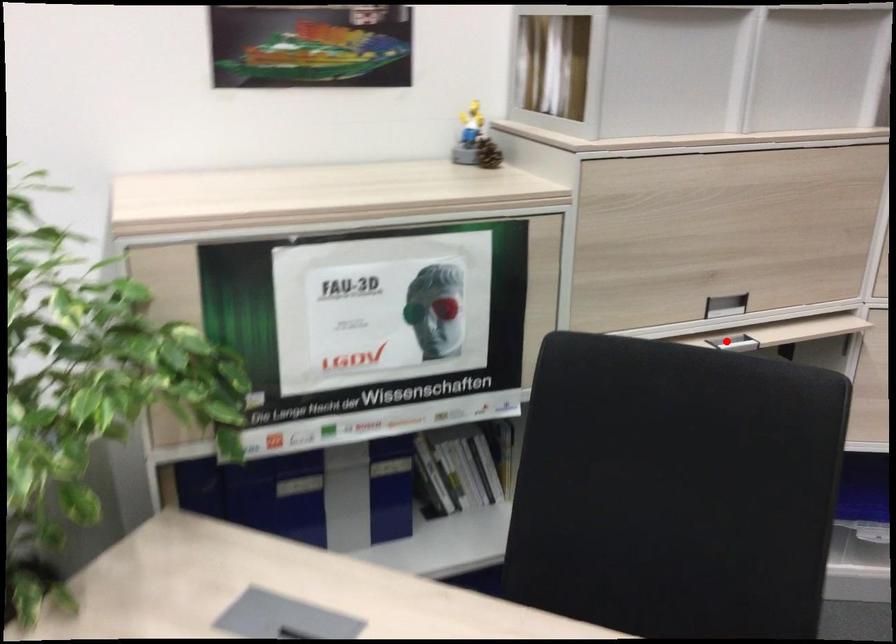
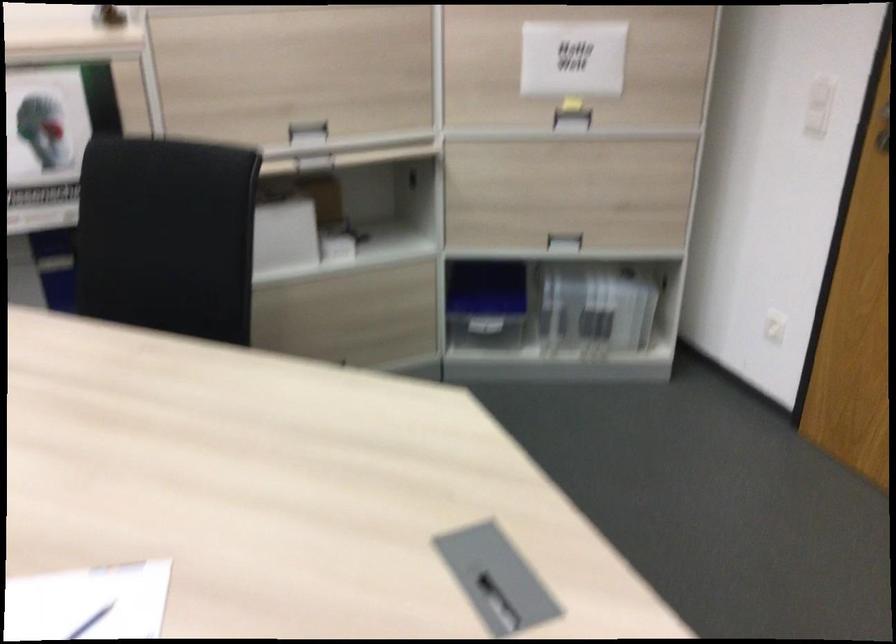
Question: A red point is marked in image1. In image2, is the corresponding 3D point closer to the camera or farther? Reply with the corresponding letter.

Choices:
 (A) The corresponding 3D point is closer.
 (B) The corresponding 3D point is farther.

Answer: (B)